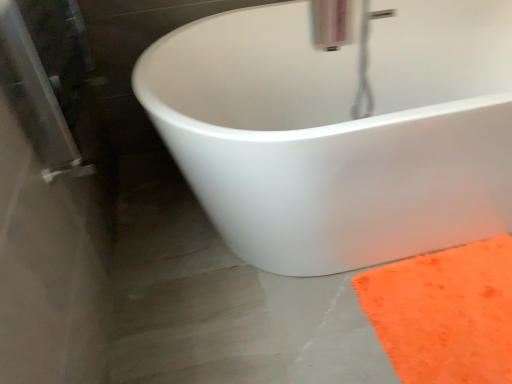
Where is `free spot to the left of orange fuzzy rug at lower right`? free spot to the left of orange fuzzy rug at lower right is located at coordinates (309, 322).